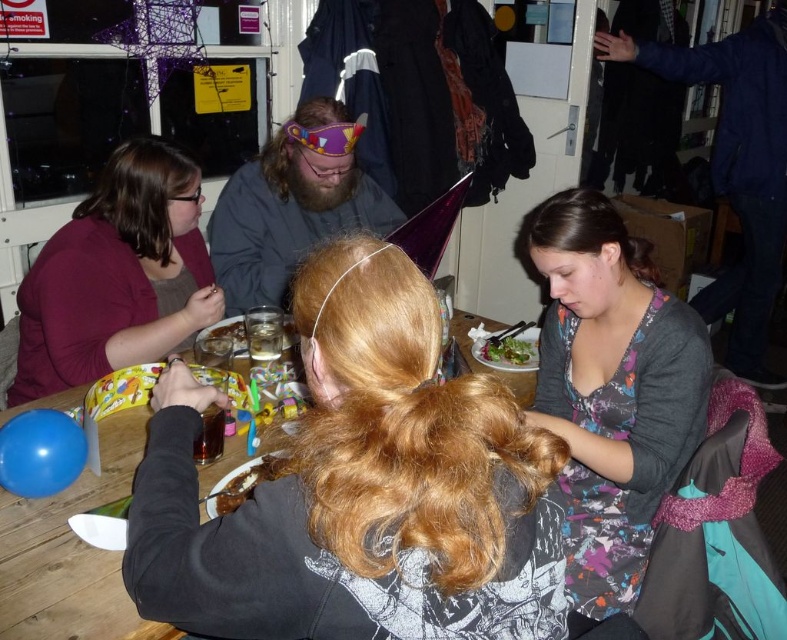
Is point (686, 321) positioned in front of point (523, 348)?

Yes, it is.

Who is lower down, floral dress at lower right or green leafy salad at center?

floral dress at lower right

Is point (615, 561) in front of point (512, 337)?

That is True.

Identify the location of floral dress at lower right. (612, 388).

Is floral dress at lower right wider than matte purple sweater at upper left?

No.

Locate an element on the screen. The height and width of the screenshot is (640, 787). floral dress at lower right is located at coordinates (612, 388).

This screenshot has width=787, height=640. In order to click on floral dress at lower right in this screenshot , I will do `click(612, 388)`.

Does chocolate cake at center come behind green leafy salad at center?

That is False.

Does point (246, 465) come closer to viewer compared to point (505, 358)?

Yes, it is in front of point (505, 358).

Find the location of a particular element. chocolate cake at center is located at coordinates (242, 483).